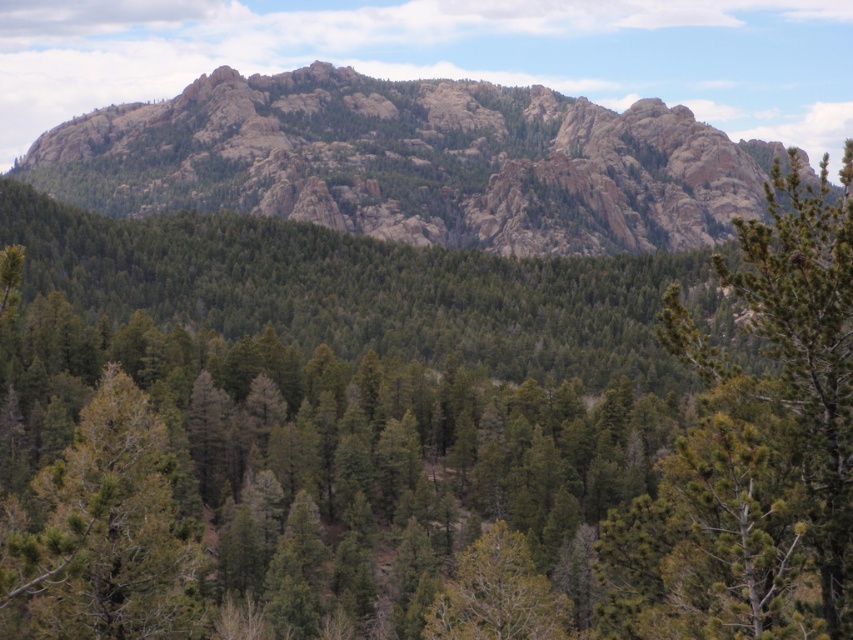
Between rugged granite mountain at upper center and green matte tree at lower left, which one appears on the right side from the viewer's perspective?

→ rugged granite mountain at upper center is more to the right.

Measure the distance from rugged granite mountain at upper center to green matte tree at lower left.

rugged granite mountain at upper center is 661.22 feet away from green matte tree at lower left.

Where is `rugged granite mountain at upper center`? This screenshot has height=640, width=853. rugged granite mountain at upper center is located at coordinates (412, 163).

Locate an element on the screen. The width and height of the screenshot is (853, 640). rugged granite mountain at upper center is located at coordinates (412, 163).

Who is lower down, rugged granite mountain at upper center or green matte tree at center?

Positioned lower is green matte tree at center.

Does rugged granite mountain at upper center appear over green matte tree at center?

Indeed, rugged granite mountain at upper center is positioned over green matte tree at center.

Is point (213, 84) positioned in front of point (476, 632)?

No.

At what (x,y) coordinates should I click in order to perform the action: click on rugged granite mountain at upper center. Please return your answer as a coordinate pair (x, y). Image resolution: width=853 pixels, height=640 pixels. Looking at the image, I should click on (412, 163).

Who is higher up, green matte tree at lower left or green matte tree at center?

green matte tree at lower left is above.

Where is `green matte tree at lower left`? This screenshot has width=853, height=640. green matte tree at lower left is located at coordinates (107, 532).

The width and height of the screenshot is (853, 640). Find the location of `green matte tree at lower left`. green matte tree at lower left is located at coordinates (107, 532).